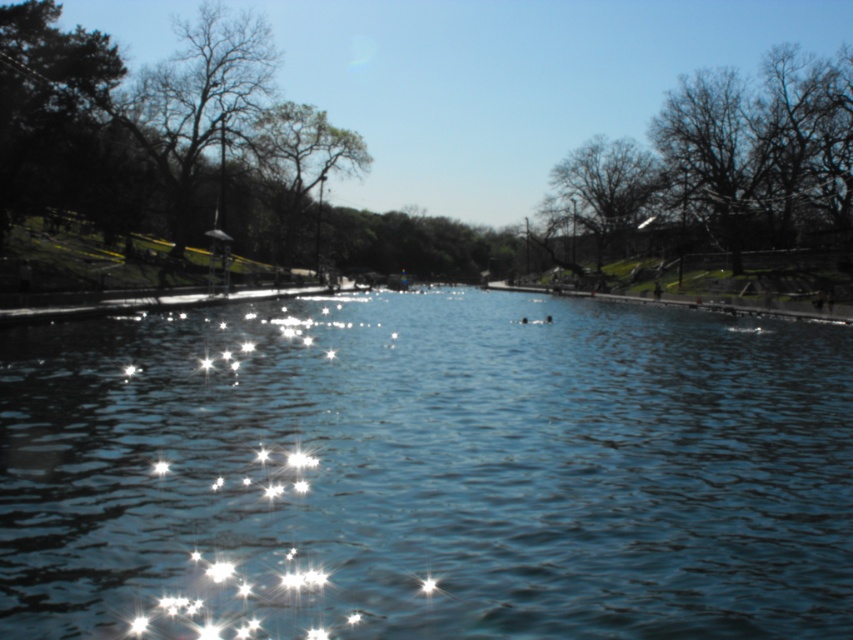
Question: Which of these objects is positioned closest to the green leafy tree at upper center?

Choices:
 (A) blue reflective water at center
 (B) dark green textured tree at upper center

Answer: (B)

Question: Does bare branches at upper right come in front of dark green textured tree at upper center?

Choices:
 (A) no
 (B) yes

Answer: (B)

Question: Where is blue reflective water at center located in relation to green leafy tree at upper center in the image?

Choices:
 (A) below
 (B) above

Answer: (A)

Question: Is blue reflective water at center below green leafy tree at upper center?

Choices:
 (A) yes
 (B) no

Answer: (A)

Question: Which of the following is the closest to the observer?

Choices:
 (A) dark green textured tree at upper center
 (B) green leafy tree at upper center
 (C) blue reflective water at center

Answer: (C)

Question: Which point is farther to the camera?

Choices:
 (A) blue reflective water at center
 (B) dark green textured tree at upper center
 (C) green leafy tree at upper center
 (D) bare branches at upper right

Answer: (B)